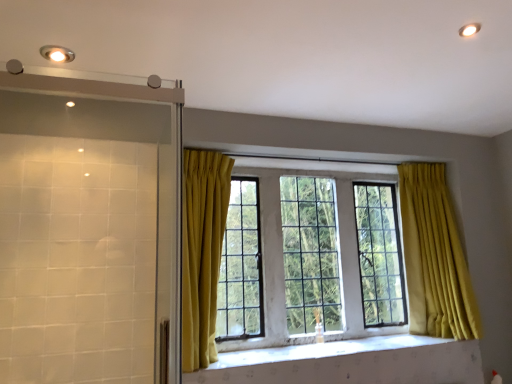
Question: Is white textured stone at center looking in the opposite direction of clear glass window at center?

Choices:
 (A) yes
 (B) no

Answer: (B)

Question: Is the position of white textured stone at center more distant than that of clear glass window at center?

Choices:
 (A) no
 (B) yes

Answer: (A)

Question: Is white textured stone at center not near clear glass window at center?

Choices:
 (A) no
 (B) yes

Answer: (A)

Question: From the image's perspective, is white textured stone at center above clear glass window at center?

Choices:
 (A) no
 (B) yes

Answer: (A)

Question: Is clear glass window at center located within white textured stone at center?

Choices:
 (A) yes
 (B) no

Answer: (B)

Question: Does white textured stone at center have a larger size compared to clear glass window at center?

Choices:
 (A) yes
 (B) no

Answer: (B)

Question: Is clear glass window at center positioned before matte silver light fixture at upper left?

Choices:
 (A) no
 (B) yes

Answer: (A)

Question: Does clear glass window at center lie behind matte silver light fixture at upper left?

Choices:
 (A) no
 (B) yes

Answer: (B)

Question: Considering the relative positions of clear glass window at center and matte silver light fixture at upper left in the image provided, is clear glass window at center to the right of matte silver light fixture at upper left from the viewer's perspective?

Choices:
 (A) no
 (B) yes

Answer: (B)

Question: Is clear glass window at center beside matte silver light fixture at upper left?

Choices:
 (A) yes
 (B) no

Answer: (B)

Question: Is clear glass window at center bigger than matte silver light fixture at upper left?

Choices:
 (A) no
 (B) yes

Answer: (B)

Question: Does clear glass window at center have a greater height compared to matte silver light fixture at upper left?

Choices:
 (A) no
 (B) yes

Answer: (B)

Question: Is matte silver light fixture at upper left outside of clear glass shower door at left?

Choices:
 (A) yes
 (B) no

Answer: (A)